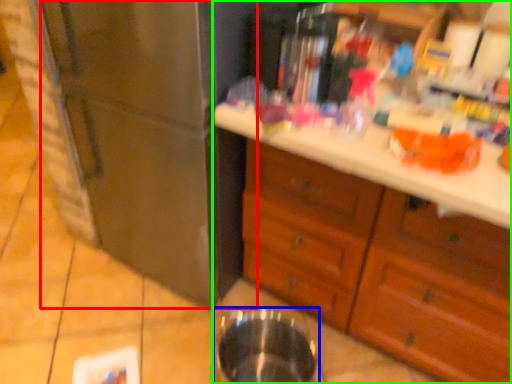
Question: Which object is the farthest from refrigerator (highlighted by a red box)? Choose among these: basin (highlighted by a blue box) or cabinetry (highlighted by a green box).

Choices:
 (A) basin
 (B) cabinetry

Answer: (A)